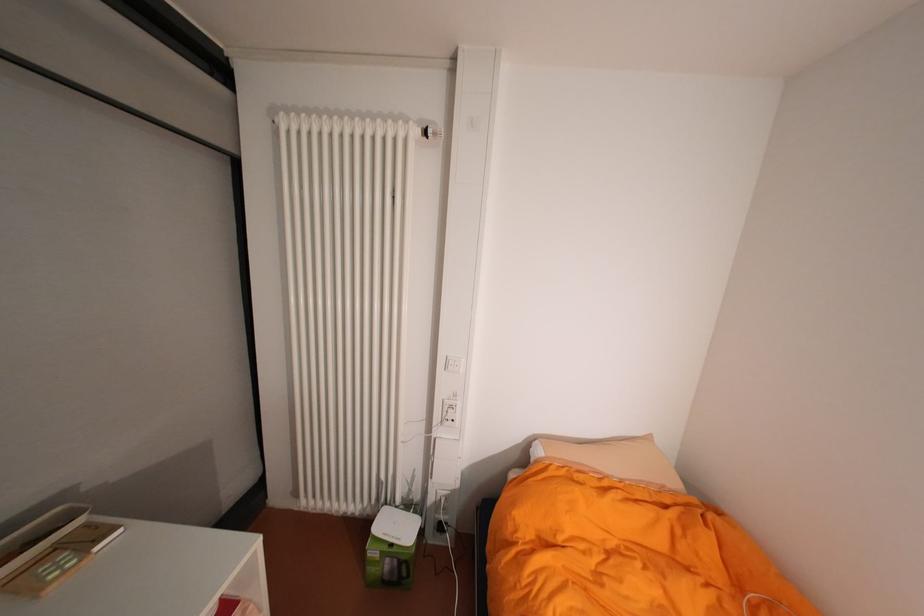
Locate an element on the screen. white light switch is located at coordinates click(x=454, y=363).